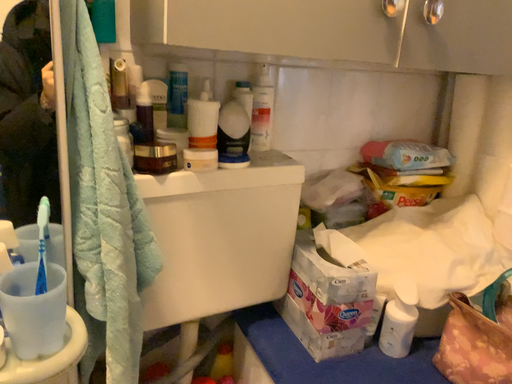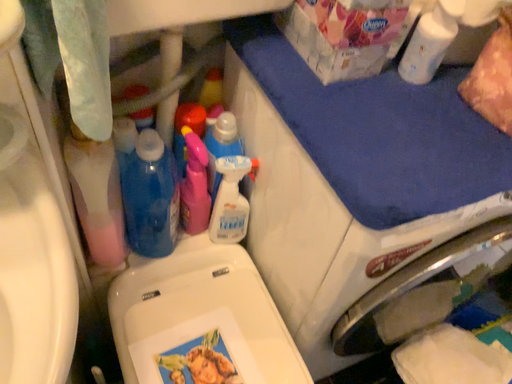
Question: How did the camera likely rotate when shooting the video?

Choices:
 (A) rotated upward
 (B) rotated downward

Answer: (B)